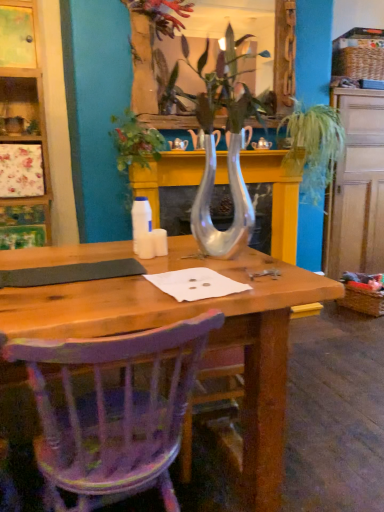
The width and height of the screenshot is (384, 512). Describe the element at coordinates (363, 301) in the screenshot. I see `woven straw picnic basket at lower right` at that location.

What do you see at coordinates (140, 219) in the screenshot? I see `white glossy bottle at center` at bounding box center [140, 219].

Locate an element on the screen. The image size is (384, 512). wooden dresser at right is located at coordinates (356, 187).

This screenshot has height=512, width=384. What do you see at coordinates (313, 146) in the screenshot?
I see `green leafy plant at upper right` at bounding box center [313, 146].

Based on the photo, what is the approximate width of green leafy plant at center?

green leafy plant at center is 17.00 inches in width.

The width and height of the screenshot is (384, 512). What do you see at coordinates (113, 410) in the screenshot?
I see `purple painted wood chair at lower left` at bounding box center [113, 410].

You are a GUI agent. You are given a task and a screenshot of the screen. Output one action in this format:
    pyautogui.click(x=<x>, y=<y>)
    Task: Click on the metallic silver flower at upper center
    This screenshot has width=384, height=512.
    Given the screenshot: What is the action you would take?
    tap(162, 14)

Is point (367, 110) positioned after point (369, 293)?

Yes, it is.

Where is `dresser behind the woven straw picnic basket at lower right`? dresser behind the woven straw picnic basket at lower right is located at coordinates (356, 187).

Is wooden dresser at right wider than woven straw picnic basket at lower right?

Correct, the width of wooden dresser at right exceeds that of woven straw picnic basket at lower right.

Who is taller, wooden dresser at right or woven straw picnic basket at lower right?

wooden dresser at right.

Considering the relative sizes of wooden dresser at right and green leafy plant at center in the image provided, is wooden dresser at right smaller than green leafy plant at center?

Incorrect, wooden dresser at right is not smaller in size than green leafy plant at center.

From the image's perspective, which is below, wooden dresser at right or green leafy plant at center?

green leafy plant at center.

Which object is further away from the camera, wooden dresser at right or green leafy plant at center?

Positioned behind is wooden dresser at right.

Looking at this image, from a real-world perspective, is wooden dresser at right under green leafy plant at center?

Yes.

Which is closer, (142,132) or (167,6)?

Positioned in front is point (142,132).

From the image's perspective, does green leafy plant at center appear higher than metallic silver flower at upper center?

Incorrect, from the image's perspective, green leafy plant at center is lower than metallic silver flower at upper center.

Identify the location of plant in front of the metallic silver flower at upper center. (133, 147).

Who is smaller, white glossy bottle at center or woven straw picnic basket at lower right?

white glossy bottle at center is smaller.

Between point (137, 197) and point (345, 298), which one is positioned behind?

The point (345, 298) is farther from the camera.

Based on the photo, is white glossy bottle at center outside of woven straw picnic basket at lower right?

Yes, white glossy bottle at center is located beyond the bounds of woven straw picnic basket at lower right.

From the image's perspective, does white glossy bottle at center appear higher than woven straw picnic basket at lower right?

Yes, from the image's perspective, white glossy bottle at center is above woven straw picnic basket at lower right.

Which of these two, wooden dresser at right or purple painted wood chair at lower left, is thinner?

Thinner between the two is purple painted wood chair at lower left.

Is wooden dresser at right taller or shorter than purple painted wood chair at lower left?

Clearly, wooden dresser at right is taller compared to purple painted wood chair at lower left.

Can you see wooden dresser at right touching purple painted wood chair at lower left?

No, wooden dresser at right is not next to purple painted wood chair at lower left.

Consider the image. How many degrees apart are the facing directions of woven straw picnic basket at lower right and metallic silver flower at upper center?

The angular difference between woven straw picnic basket at lower right and metallic silver flower at upper center is 14.4 degrees.

Is point (370, 313) closer to camera compared to point (130, 7)?

No.

Find the location of a particular element. picnic basket on the right of the metallic silver flower at upper center is located at coordinates [x=363, y=301].

From a real-world perspective, relative to metallic silver flower at upper center, is woven straw picnic basket at lower right vertically above or below?

Clearly, from a real-world perspective, woven straw picnic basket at lower right is below metallic silver flower at upper center.

Considering the relative sizes of metallic silver flower at upper center and woven straw picnic basket at lower right in the image provided, is metallic silver flower at upper center smaller than woven straw picnic basket at lower right?

Yes, metallic silver flower at upper center is smaller than woven straw picnic basket at lower right.

Choose the correct answer: Is metallic silver flower at upper center inside woven straw picnic basket at lower right or outside it?

The correct answer is: outside.

Is metallic silver flower at upper center behind woven straw picnic basket at lower right?

No.

This screenshot has height=512, width=384. There is a woven straw picnic basket at lower right. Find the location of `flower above it (from a real-world perspective)`. flower above it (from a real-world perspective) is located at coordinates (162, 14).

Locate an element on the screen. The width and height of the screenshot is (384, 512). picnic basket that appears on the left of wooden dresser at right is located at coordinates (363, 301).

Identify the location of plant below the wooden dresser at right (from the image's perspective). (x=133, y=147).

Looking at the image, which one is located closer to woven straw picnic basket at lower right, metallic silver flower at upper center or purple painted wood chair at lower left?

metallic silver flower at upper center is positioned closer to the anchor woven straw picnic basket at lower right.

Considering their positions, is white glossy bottle at center positioned closer to purple painted wood chair at lower left than metallic silver flower at upper center?

white glossy bottle at center is closer to purple painted wood chair at lower left.

Estimate the real-world distances between objects in this image. Which object is further from green leafy plant at upper right, green leafy plant at center or wooden dresser at right?

green leafy plant at center lies further to green leafy plant at upper right than the other object.

Considering their positions, is white glossy bottle at center positioned closer to green leafy plant at upper right than metallic silver flower at upper center?

metallic silver flower at upper center.

Which object lies further to the anchor point purple painted wood chair at lower left, white glossy bottle at center or wooden dresser at right?

wooden dresser at right is further to purple painted wood chair at lower left.

Considering their positions, is green leafy plant at upper right positioned closer to wooden dresser at right than woven straw picnic basket at lower right?

green leafy plant at upper right is closer to wooden dresser at right.

Considering their positions, is metallic silver flower at upper center positioned further to green leafy plant at center than purple painted wood chair at lower left?

Based on the image, purple painted wood chair at lower left appears to be further to green leafy plant at center.

Estimate the real-world distances between objects in this image. Which object is further from white glossy bottle at center, metallic silver flower at upper center or wooden dresser at right?

wooden dresser at right is positioned further to the anchor white glossy bottle at center.

Where is `bottle located between purple painted wood chair at lower left and green leafy plant at upper right in the depth direction`? bottle located between purple painted wood chair at lower left and green leafy plant at upper right in the depth direction is located at coordinates (140, 219).

Find the location of a particular element. This screenshot has width=384, height=512. bottle between metallic silver flower at upper center and woven straw picnic basket at lower right in the up-down direction is located at coordinates [140, 219].

Locate an element on the screen. The image size is (384, 512). flower between green leafy plant at center and woven straw picnic basket at lower right from left to right is located at coordinates (162, 14).

Locate an element on the screen. flower positioned between purple painted wood chair at lower left and woven straw picnic basket at lower right from near to far is located at coordinates (162, 14).